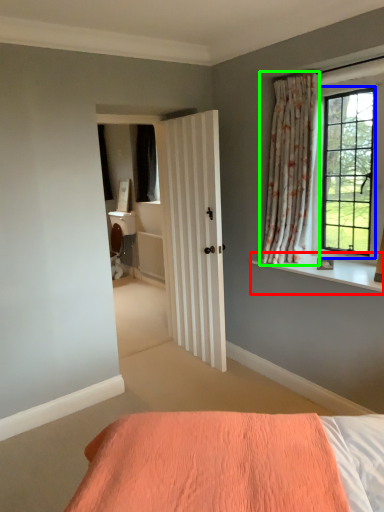
Question: Which is nearer to the window sill (highlighted by a red box)? window (highlighted by a blue box) or curtain (highlighted by a green box).

Choices:
 (A) window
 (B) curtain

Answer: (A)